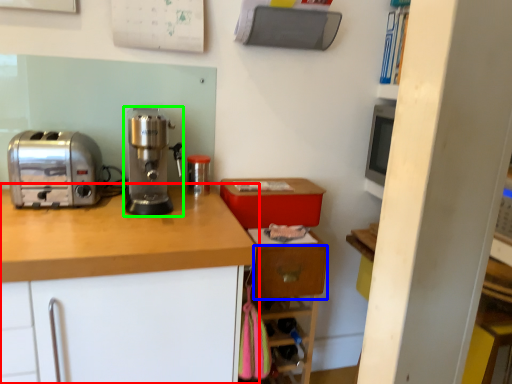
Question: Which object is the farthest from cabinetry (highlighted by a red box)? Choose among these: drawer (highlighted by a blue box) or home appliance (highlighted by a green box).

Choices:
 (A) drawer
 (B) home appliance

Answer: (A)